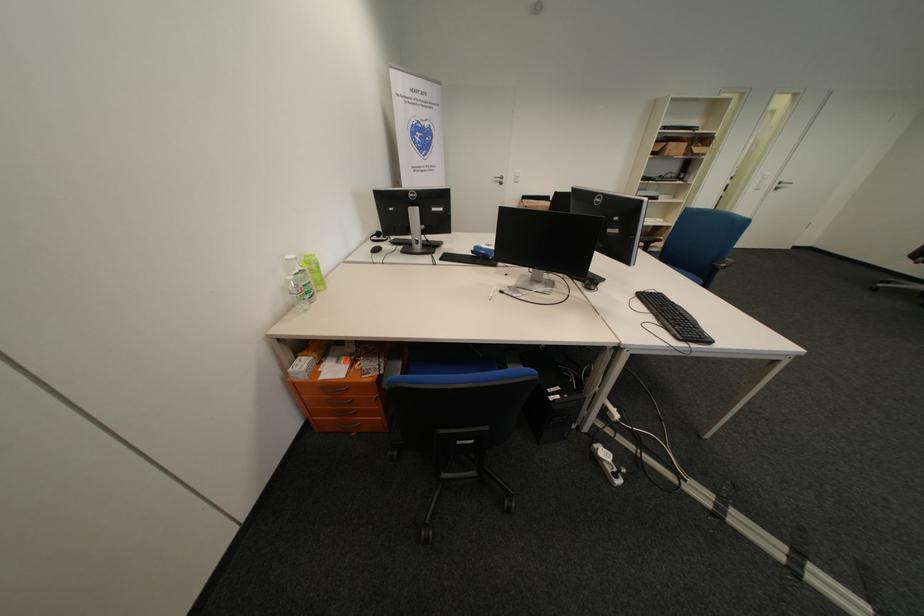
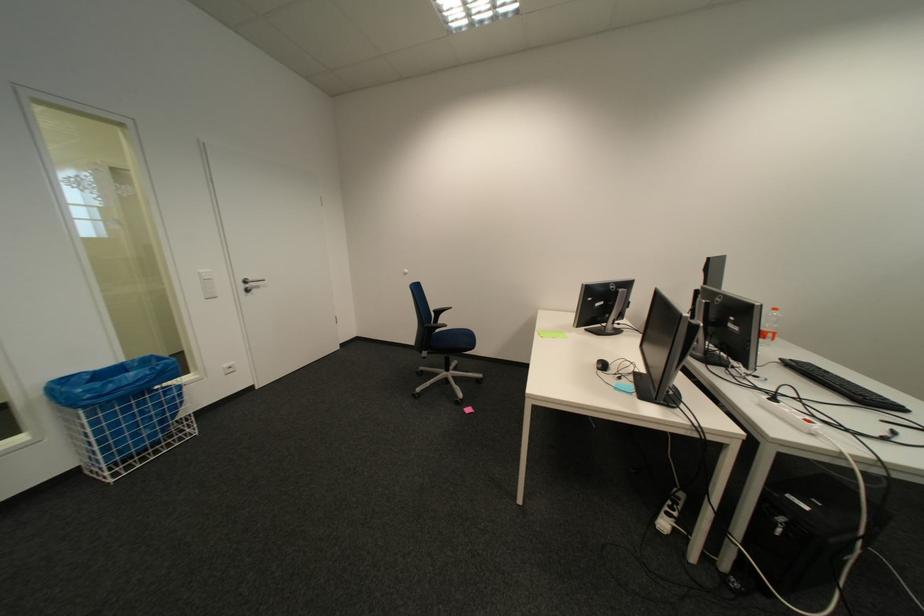
Find the pixel in the second image that matches [775,176] in the first image.

(212, 275)